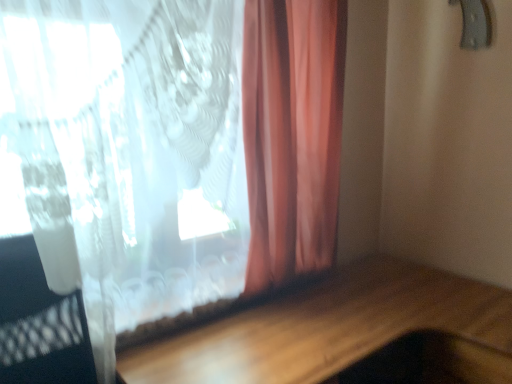
Find the location of a particular element. wooden table at lower center is located at coordinates (325, 327).

Describe the element at coordinates (475, 24) in the screenshot. I see `metallic gray door handle at upper right` at that location.

At what (x,y) coordinates should I click in order to perform the action: click on translucent fabric curtain at upper left. Please return your answer as a coordinate pair (x, y). The height and width of the screenshot is (384, 512). Looking at the image, I should click on (153, 158).

Find the location of a particular element. Image resolution: width=512 pixels, height=384 pixels. wooden table at lower center is located at coordinates (325, 327).

From the image's perspective, who appears lower, metallic gray door handle at upper right or wooden table at lower center?

wooden table at lower center, from the image's perspective.

From a real-world perspective, is metallic gray door handle at upper right located higher than wooden table at lower center?

Yes, from a real-world perspective, metallic gray door handle at upper right is above wooden table at lower center.

Can wooden table at lower center be found inside metallic gray door handle at upper right?

No.

From the image's perspective, is wooden table at lower center above or below metallic gray door handle at upper right?

Based on their image positions, wooden table at lower center is located beneath metallic gray door handle at upper right.

Is there a large distance between wooden table at lower center and metallic gray door handle at upper right?

wooden table at lower center is far away from metallic gray door handle at upper right.

Which is in front, point (263, 342) or point (474, 9)?

Positioned in front is point (263, 342).

From a real-world perspective, which is physically below, wooden table at lower center or translucent fabric curtain at upper left?

wooden table at lower center is physically lower.

Looking at this image, which of these two, wooden table at lower center or translucent fabric curtain at upper left, is thinner?

translucent fabric curtain at upper left.

Which object is closer to the camera taking this photo, wooden table at lower center or translucent fabric curtain at upper left?

wooden table at lower center.

Is wooden table at lower center positioned with its back to translucent fabric curtain at upper left?

wooden table at lower center does not have its back to translucent fabric curtain at upper left.

Who is smaller, translucent fabric curtain at upper left or metallic gray door handle at upper right?

metallic gray door handle at upper right.

Is translucent fabric curtain at upper left positioned with its back to metallic gray door handle at upper right?

translucent fabric curtain at upper left does not have its back to metallic gray door handle at upper right.

Considering the relative positions of translucent fabric curtain at upper left and metallic gray door handle at upper right in the image provided, is translucent fabric curtain at upper left to the left or to the right of metallic gray door handle at upper right?

In the image, translucent fabric curtain at upper left appears on the left side of metallic gray door handle at upper right.

Which of these two, translucent fabric curtain at upper left or metallic gray door handle at upper right, stands taller?

translucent fabric curtain at upper left is taller.

Considering the sizes of objects translucent fabric curtain at upper left and wooden table at lower center in the image provided, who is bigger, translucent fabric curtain at upper left or wooden table at lower center?

Bigger between the two is wooden table at lower center.

Relative to wooden table at lower center, is translucent fabric curtain at upper left in front or behind?

Visually, translucent fabric curtain at upper left is located behind wooden table at lower center.

Between translucent fabric curtain at upper left and wooden table at lower center, which one has more height?

translucent fabric curtain at upper left is taller.

Consider the image. From the image's perspective, which is below, translucent fabric curtain at upper left or wooden table at lower center?

wooden table at lower center is shown below in the image.

Is translucent fabric curtain at upper left at the back of metallic gray door handle at upper right?

No, metallic gray door handle at upper right is not facing the opposite direction of translucent fabric curtain at upper left.

Does metallic gray door handle at upper right touch translucent fabric curtain at upper left?

No, metallic gray door handle at upper right is not in contact with translucent fabric curtain at upper left.

Who is bigger, metallic gray door handle at upper right or translucent fabric curtain at upper left?

With larger size is translucent fabric curtain at upper left.

From the image's perspective, is metallic gray door handle at upper right located above translucent fabric curtain at upper left?

Yes, from the image's perspective, metallic gray door handle at upper right is on top of translucent fabric curtain at upper left.

Where is `door handle positioned vertically above the wooden table at lower center (from a real-world perspective)`? The height and width of the screenshot is (384, 512). door handle positioned vertically above the wooden table at lower center (from a real-world perspective) is located at coordinates (475, 24).

Find the location of a particular element. table on the left of metallic gray door handle at upper right is located at coordinates (325, 327).

Estimate the real-world distances between objects in this image. Which object is closer to wooden table at lower center, translucent fabric curtain at upper left or metallic gray door handle at upper right?

Based on the image, translucent fabric curtain at upper left appears to be nearer to wooden table at lower center.

Considering their positions, is metallic gray door handle at upper right positioned closer to wooden table at lower center than translucent fabric curtain at upper left?

Among the two, translucent fabric curtain at upper left is located nearer to wooden table at lower center.

From the image, which object appears to be farther from translucent fabric curtain at upper left, metallic gray door handle at upper right or wooden table at lower center?

metallic gray door handle at upper right lies further to translucent fabric curtain at upper left than the other object.

Considering their positions, is wooden table at lower center positioned closer to translucent fabric curtain at upper left than metallic gray door handle at upper right?

wooden table at lower center is closer to translucent fabric curtain at upper left.

Estimate the real-world distances between objects in this image. Which object is closer to metallic gray door handle at upper right, wooden table at lower center or translucent fabric curtain at upper left?

Among the two, translucent fabric curtain at upper left is located nearer to metallic gray door handle at upper right.

Based on the photo, looking at the image, which one is located closer to metallic gray door handle at upper right, translucent fabric curtain at upper left or wooden table at lower center?

translucent fabric curtain at upper left is positioned closer to the anchor metallic gray door handle at upper right.

You are a GUI agent. You are given a task and a screenshot of the screen. Output one action in this format:
    pyautogui.click(x=<x>, y=<y>)
    Task: Click on the curtain between metallic gray door handle at upper right and wooden table at lower center vertically
    This screenshot has width=512, height=384.
    Given the screenshot: What is the action you would take?
    pyautogui.click(x=153, y=158)